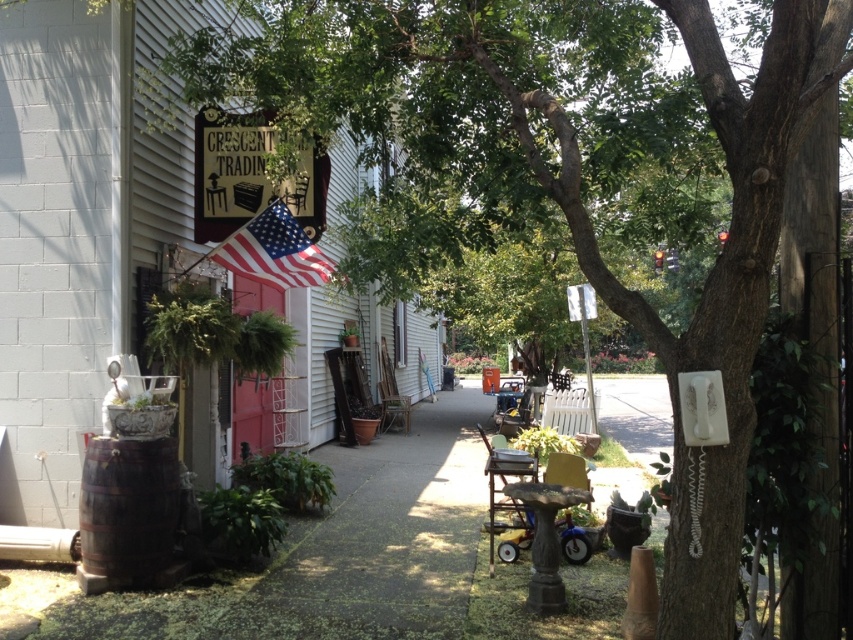
Question: Which object appears farthest from the camera in this image?

Choices:
 (A) american flag at upper left
 (B) wooden sign at upper center
 (C) wooden sign at center

Answer: (A)

Question: Which point is closer to the camera?

Choices:
 (A) (242, 218)
 (B) (44, 362)
 (C) (241, 234)

Answer: (B)

Question: Considering the relative positions of wooden sign at center and american flag at upper left in the image provided, where is wooden sign at center located with respect to american flag at upper left?

Choices:
 (A) left
 (B) right

Answer: (A)

Question: Is wooden sign at upper center smaller than american flag at upper left?

Choices:
 (A) no
 (B) yes

Answer: (A)

Question: Is wooden sign at upper center smaller than american flag at upper left?

Choices:
 (A) yes
 (B) no

Answer: (B)

Question: Among these objects, which one is farthest from the camera?

Choices:
 (A) american flag at upper left
 (B) wooden sign at center

Answer: (A)